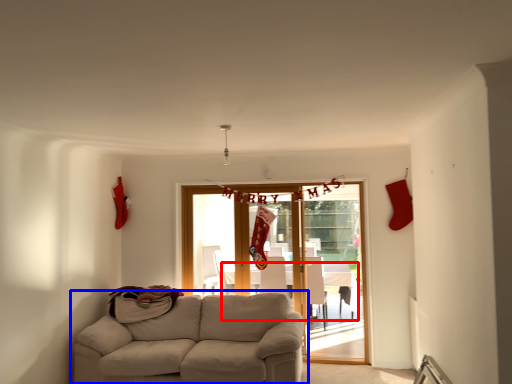
Question: Which point is closer to the camera, table (highlighted by a red box) or studio couch (highlighted by a blue box)?

Choices:
 (A) table
 (B) studio couch

Answer: (B)